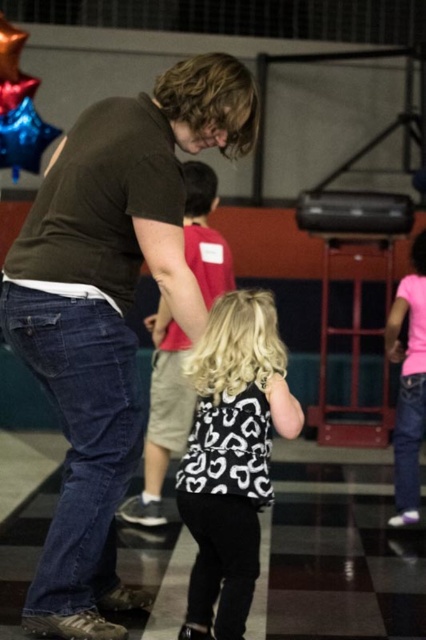
Question: Does matte brown shirt at center lie in front of pink matte shirt at right?

Choices:
 (A) no
 (B) yes

Answer: (B)

Question: Considering the real-world distances, which object is farthest from the matte brown shirt at center?

Choices:
 (A) black printed dress at center
 (B) pink matte shirt at right
 (C) black matte dress at center

Answer: (B)

Question: Which is farther from the black printed dress at center?

Choices:
 (A) black matte dress at center
 (B) matte brown shirt at center
 (C) pink matte shirt at right

Answer: (C)

Question: Can you confirm if matte brown shirt at center is smaller than pink matte shirt at right?

Choices:
 (A) yes
 (B) no

Answer: (B)

Question: Where is matte brown shirt at center located in relation to black printed dress at center in the image?

Choices:
 (A) above
 (B) below

Answer: (A)

Question: Which of the following is the farthest from the observer?

Choices:
 (A) (402, 404)
 (B) (75, 321)
 (C) (219, 600)
 (D) (154, 387)

Answer: (A)